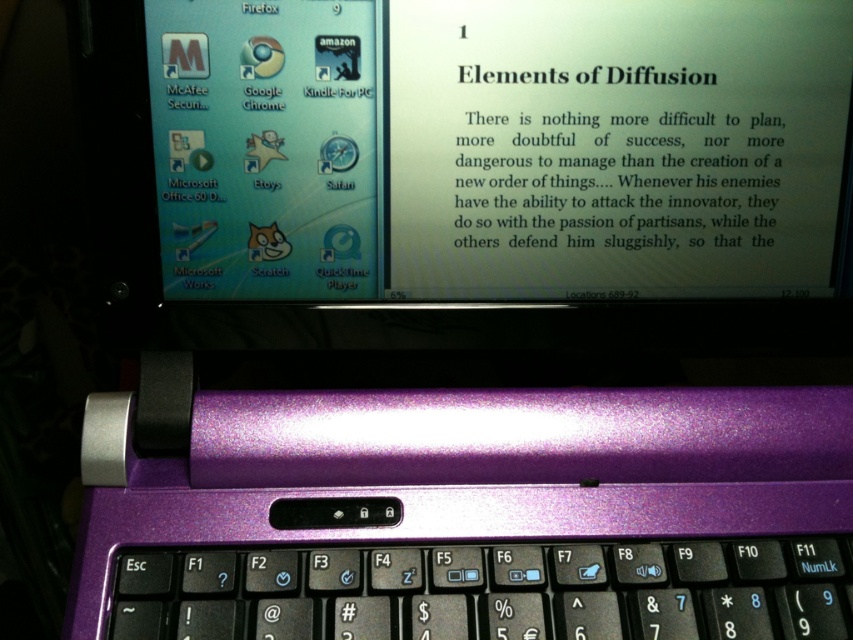
Is purple metallic laptop at upper center below purple metallic keyboard at center?

Actually, purple metallic laptop at upper center is above purple metallic keyboard at center.

Who is positioned more to the right, purple metallic laptop at upper center or purple metallic keyboard at center?

From the viewer's perspective, purple metallic laptop at upper center appears more on the right side.

The image size is (853, 640). Describe the element at coordinates (498, 147) in the screenshot. I see `purple metallic laptop at upper center` at that location.

The image size is (853, 640). What are the coordinates of `purple metallic laptop at upper center` in the screenshot? It's located at (498, 147).